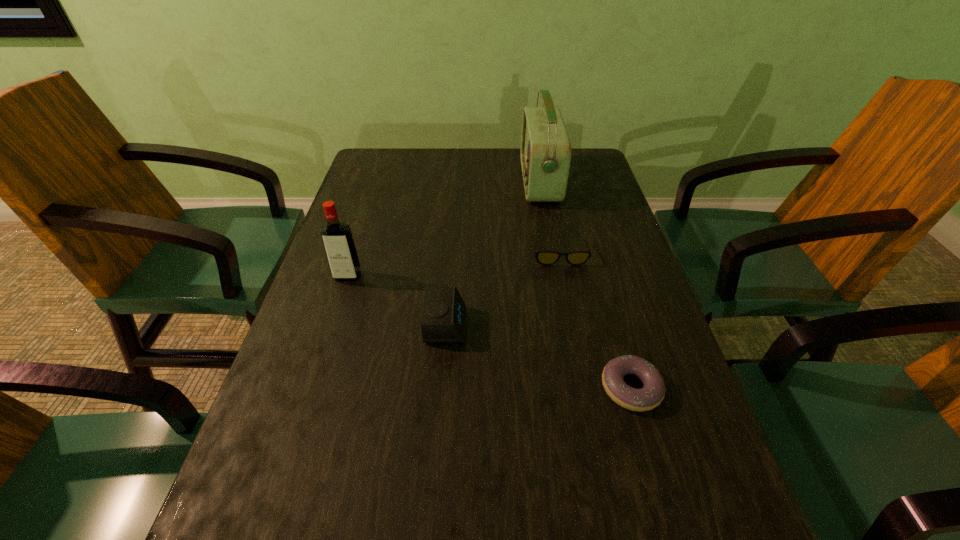
At what (x,y) coordinates should I click in order to perform the action: click on vacant area that satisfies the following two spatial constraints: 1. on the front-facing side of the sunglasses; 2. on the front-facing side of the third shortest object. Please return your answer as a coordinate pair (x, y). The width and height of the screenshot is (960, 540). Looking at the image, I should click on (574, 325).

At what (x,y) coordinates should I click in order to perform the action: click on vacant area that satisfies the following two spatial constraints: 1. on the front panel of the tallest object; 2. on the front and back of the vodka. Please return your answer as a coordinate pair (x, y). Looking at the image, I should click on (557, 276).

Identify the location of vacant point that satisfies the following two spatial constraints: 1. on the front panel of the doughnut; 2. on the right side of the tallest object. (578, 388).

Locate an element on the screen. The height and width of the screenshot is (540, 960). free space that satisfies the following two spatial constraints: 1. on the front-facing side of the alarm clock; 2. on the back side of the nearest object is located at coordinates (442, 388).

Find the location of `free space in the image that satisfies the following two spatial constraints: 1. on the back side of the doughnut; 2. on the front panel of the radio receiver`. free space in the image that satisfies the following two spatial constraints: 1. on the back side of the doughnut; 2. on the front panel of the radio receiver is located at coordinates (571, 182).

The height and width of the screenshot is (540, 960). Find the location of `free spot that satisfies the following two spatial constraints: 1. on the front-facing side of the doughnut; 2. on the left side of the sunglasses`. free spot that satisfies the following two spatial constraints: 1. on the front-facing side of the doughnut; 2. on the left side of the sunglasses is located at coordinates (587, 388).